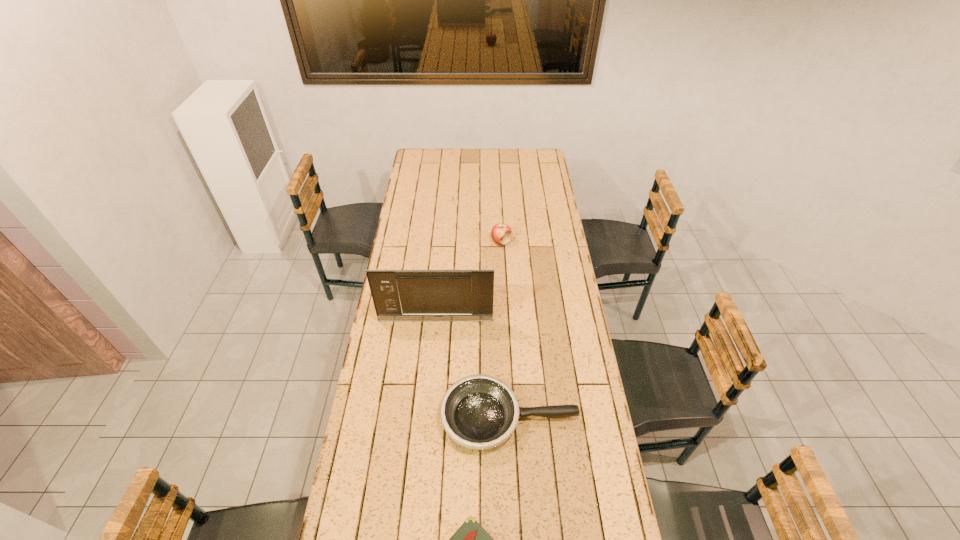
Where is `the third nearest object`? Image resolution: width=960 pixels, height=540 pixels. the third nearest object is located at coordinates (398, 295).

Locate an element on the screen. The width and height of the screenshot is (960, 540). the tallest object is located at coordinates (398, 295).

Identify the location of apple. This screenshot has height=540, width=960. (501, 233).

Where is `the third shortest object`? The image size is (960, 540). the third shortest object is located at coordinates (501, 233).

In order to click on the second shortest object in this screenshot , I will do `click(479, 412)`.

Identify the location of frying pan. Image resolution: width=960 pixels, height=540 pixels. (479, 412).

I want to click on free location located 0.120m on the front panel of the microwave oven, so click(433, 346).

This screenshot has height=540, width=960. What are the coordinates of `free region located 0.120m on the right of the second tallest object` in the screenshot? It's located at (536, 242).

The image size is (960, 540). I want to click on object at the left edge, so click(x=398, y=295).

This screenshot has height=540, width=960. I want to click on object that is at the right edge, so click(479, 412).